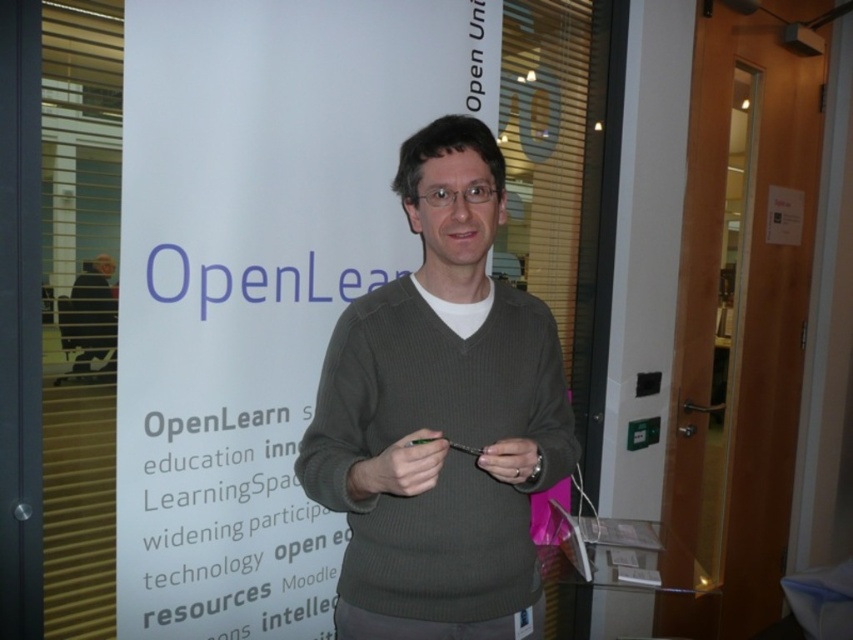
Question: Which object is farther from the camera taking this photo?

Choices:
 (A) knitted sweater at center
 (B) matte gray hand at center

Answer: (B)

Question: Is knitted sweater at center closer to camera compared to matte gray hand at center?

Choices:
 (A) yes
 (B) no

Answer: (A)

Question: Does knitted sweater at center appear on the left side of matte green pen at center?

Choices:
 (A) no
 (B) yes

Answer: (A)

Question: Which point appears farthest from the camera in this image?

Choices:
 (A) (415, 456)
 (B) (485, 432)
 (C) (480, 465)

Answer: (B)

Question: Can you confirm if knitted sweater at center is positioned to the right of matte gray hand at center?

Choices:
 (A) yes
 (B) no

Answer: (B)

Question: Which point is farther to the camera?

Choices:
 (A) matte green pen at center
 (B) knitted sweater at center
 (C) matte gray hand at center

Answer: (C)